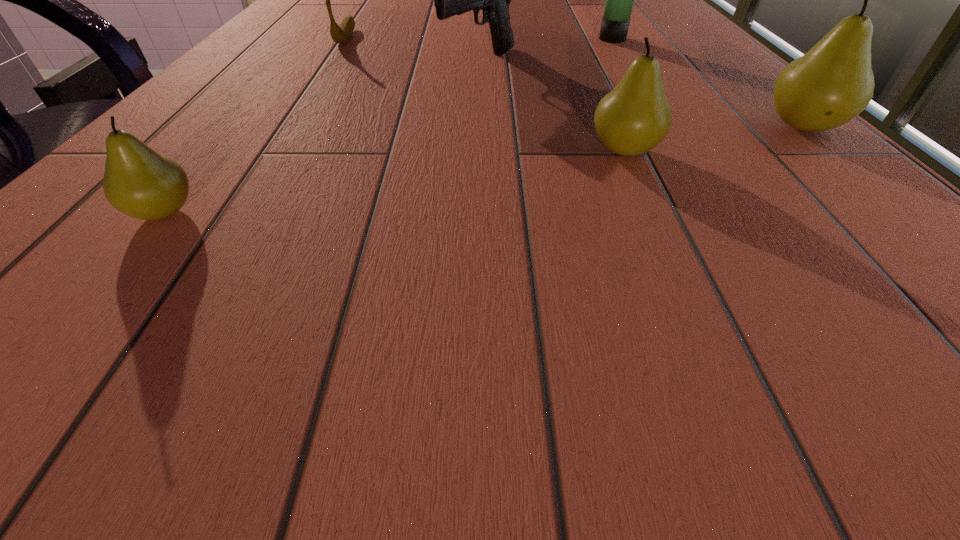
Where is `the third object from left to right`? the third object from left to right is located at coordinates (449, 0).

The image size is (960, 540). What are the coordinates of `vacant space located on the right of the second shortest object` in the screenshot? It's located at (318, 213).

In order to click on vacant region located 0.170m on the left of the second pear from left to right in this screenshot , I will do `click(458, 151)`.

Find the location of `vacant region located on the front of the rightmost pear`. vacant region located on the front of the rightmost pear is located at coordinates (876, 195).

Find the location of a particular element. The height and width of the screenshot is (540, 960). vacant space located at the stem of the banana is located at coordinates (314, 86).

The width and height of the screenshot is (960, 540). Identify the location of vacant area located 0.370m on the left of the fifth object from left to right. (416, 39).

Locate an element on the screen. vacant area located 0.250m at the muzzle of the fourth object from right to left is located at coordinates (x=479, y=162).

Locate an element on the screen. object that is at the near edge is located at coordinates (138, 181).

At what (x,y) coordinates should I click in order to perform the action: click on pear that is positioned at the left edge. Please return your answer as a coordinate pair (x, y). Image resolution: width=960 pixels, height=540 pixels. Looking at the image, I should click on (138, 181).

What are the coordinates of `banana at the left edge` in the screenshot? It's located at (340, 34).